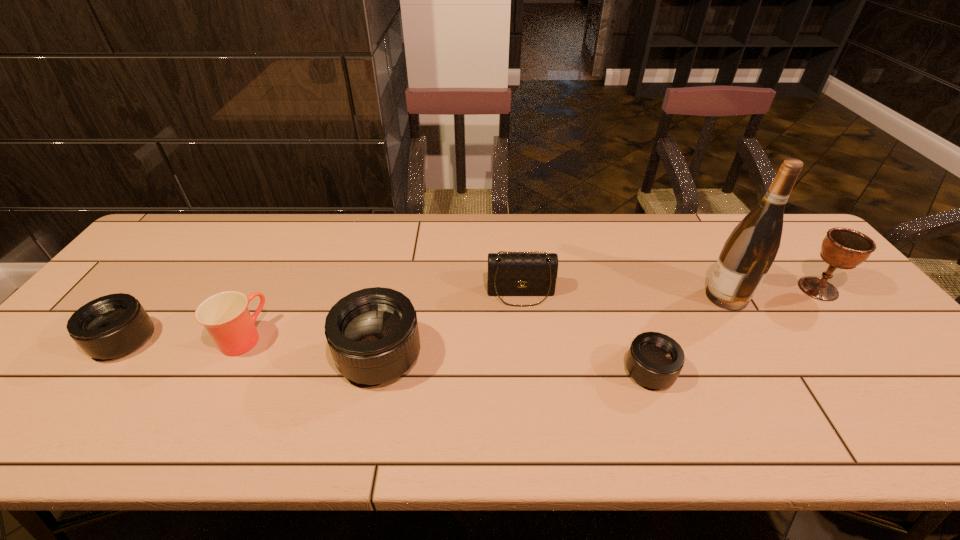
All telephoto lenss are currently evenly spaced. To continue this pattern, where would you add another telephoto lens on the right? Please point out a vacant spot. Please provide its 2D coordinates. Your answer should be formatted as a tuple, i.e. [(x, y)], where the tuple contains the x and y coordinates of a point satisfying the conditions above.

[(942, 389)]